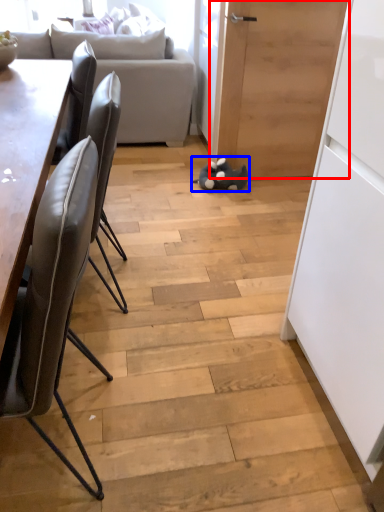
Question: Which of the following is the farthest to the observer, door (highlighted by a red box) or toy (highlighted by a blue box)?

Choices:
 (A) door
 (B) toy

Answer: (B)